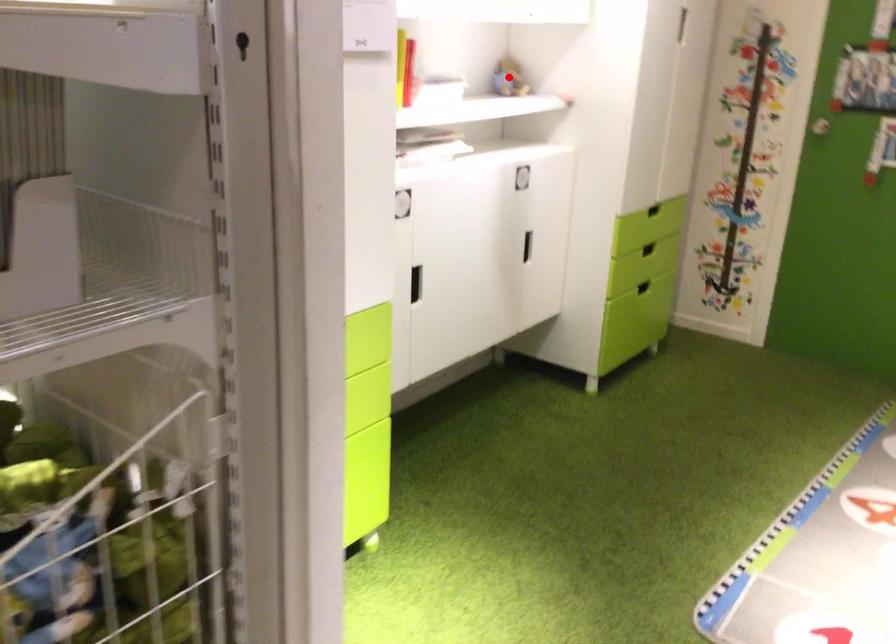
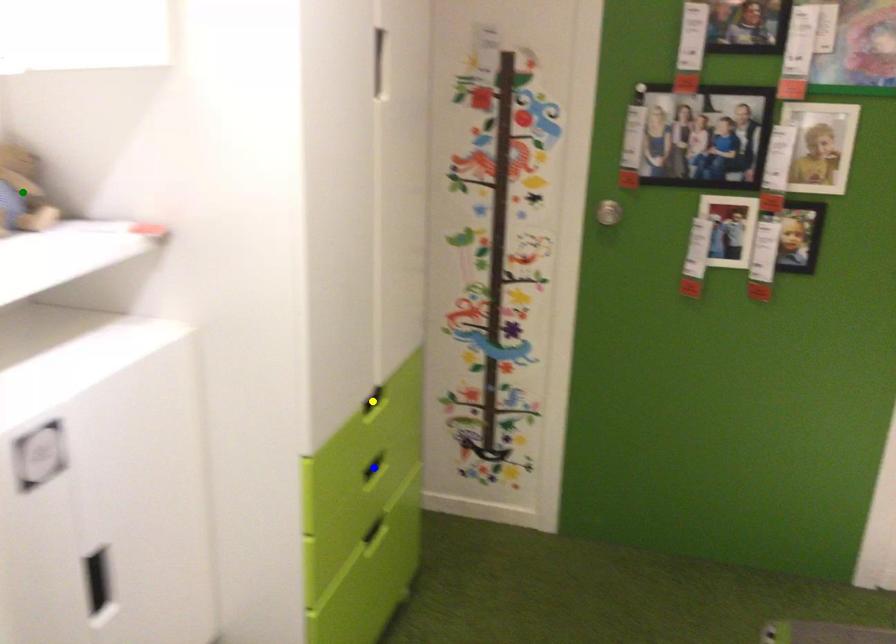
Question: I am providing you with two images of the same scene from different viewpoints. A red point is marked on the first image. You are given multiple points on the second image. Which spot in image 2 lines up with the point in image 1?

Choices:
 (A) blue point
 (B) yellow point
 (C) green point

Answer: (C)